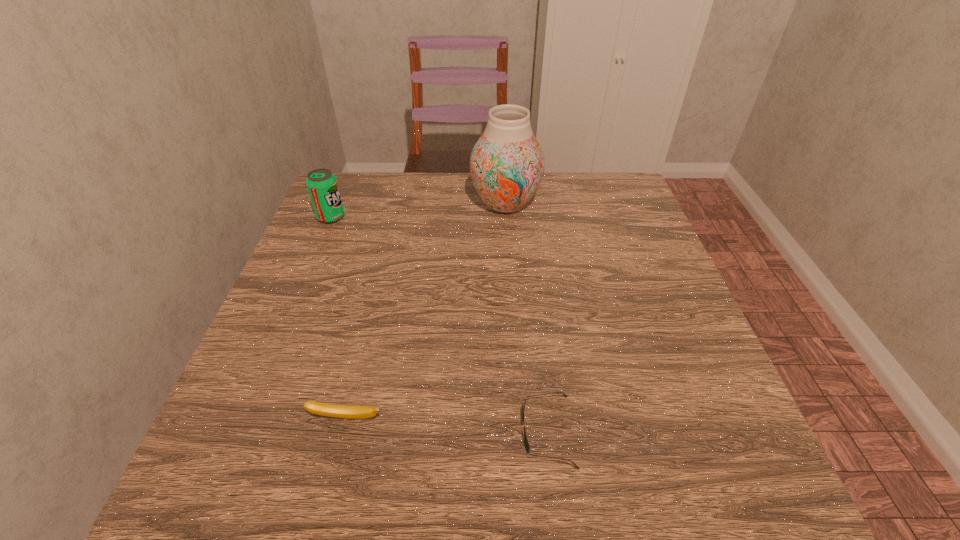
Identify the location of blank space located 0.240m on the lenses of the shortest object. Image resolution: width=960 pixels, height=540 pixels. (374, 431).

The height and width of the screenshot is (540, 960). I want to click on free space located on the lenses of the shortest object, so click(x=343, y=431).

Identify the location of vase at the far edge. The image size is (960, 540). (507, 163).

Image resolution: width=960 pixels, height=540 pixels. What are the coordinates of `pop soda located in the far edge section of the desktop` in the screenshot? It's located at (322, 186).

Identify the location of object present at the near edge. (527, 447).

Where is `pop soda situated at the left edge`? pop soda situated at the left edge is located at coordinates (322, 186).

The width and height of the screenshot is (960, 540). I want to click on banana located at the left edge, so click(331, 410).

At what (x,y) coordinates should I click in order to perform the action: click on object that is positioned at the far left corner. Please return your answer as a coordinate pair (x, y). Image resolution: width=960 pixels, height=540 pixels. Looking at the image, I should click on (322, 186).

Identify the location of free space at the far edge of the desktop. The width and height of the screenshot is (960, 540). (500, 214).

I want to click on vacant space at the near edge of the desktop, so click(619, 465).